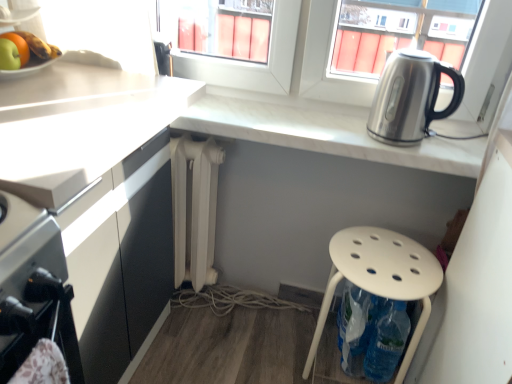
Locate an element on the screen. This screenshot has width=512, height=384. free location in front of shiny metallic bowl at upper left is located at coordinates (34, 85).